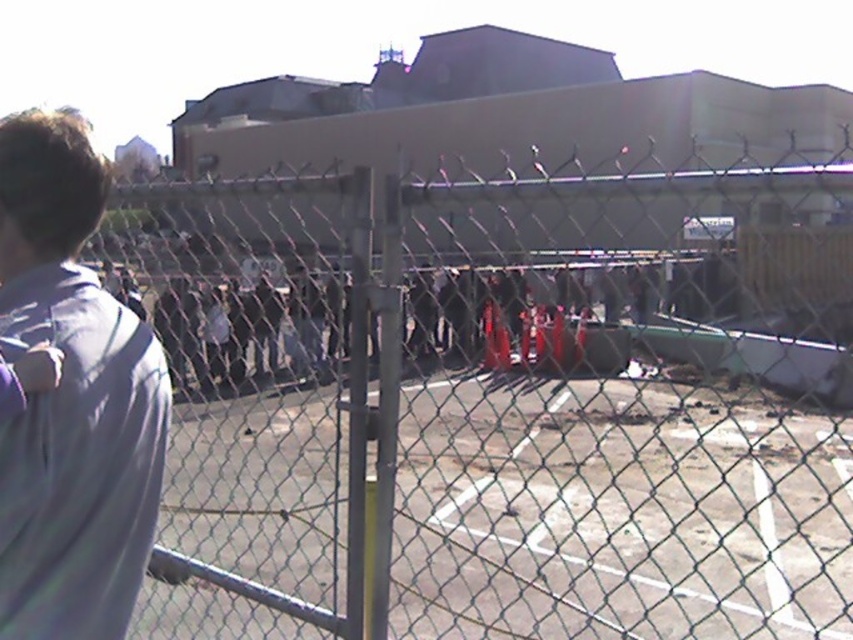
Does point (492, 488) come in front of point (27, 208)?

No, (492, 488) is behind (27, 208).

At what (x,y) coordinates should I click in order to perform the action: click on chain link fence at left. Please return your answer as a coordinate pair (x, y). The image size is (853, 640). Looking at the image, I should click on (506, 400).